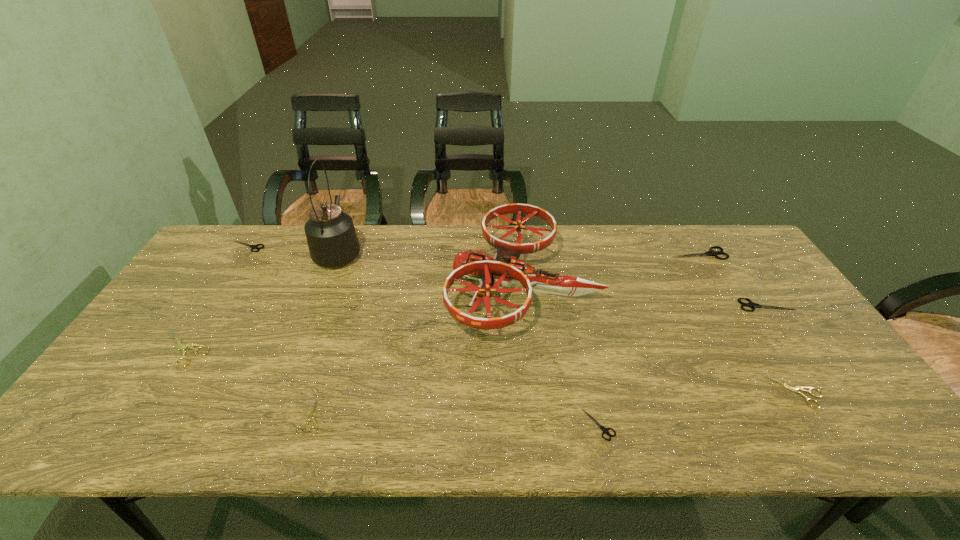
In order to click on kettle in this screenshot , I will do `click(332, 240)`.

At what (x,y) coordinates should I click in order to perform the action: click on the second tallest object. Please return your answer as a coordinate pair (x, y). The height and width of the screenshot is (540, 960). Looking at the image, I should click on (505, 268).

The width and height of the screenshot is (960, 540). In order to click on drone in this screenshot , I will do `click(505, 268)`.

Image resolution: width=960 pixels, height=540 pixels. In order to click on the biggest black shears in this screenshot , I will do `click(709, 253)`.

Identify the location of the tallest shears. (709, 253).

What are the coordinates of `the sixth shortest object` in the screenshot? It's located at (752, 305).

This screenshot has height=540, width=960. I want to click on the fifth nearest shears, so click(752, 305).

Locate an element on the screen. Image resolution: width=960 pixels, height=540 pixels. the leftmost black shears is located at coordinates (251, 246).

The width and height of the screenshot is (960, 540). Find the location of `the fourth farthest shears`. the fourth farthest shears is located at coordinates (182, 347).

Locate an element on the screen. the biggest beige shears is located at coordinates (182, 347).